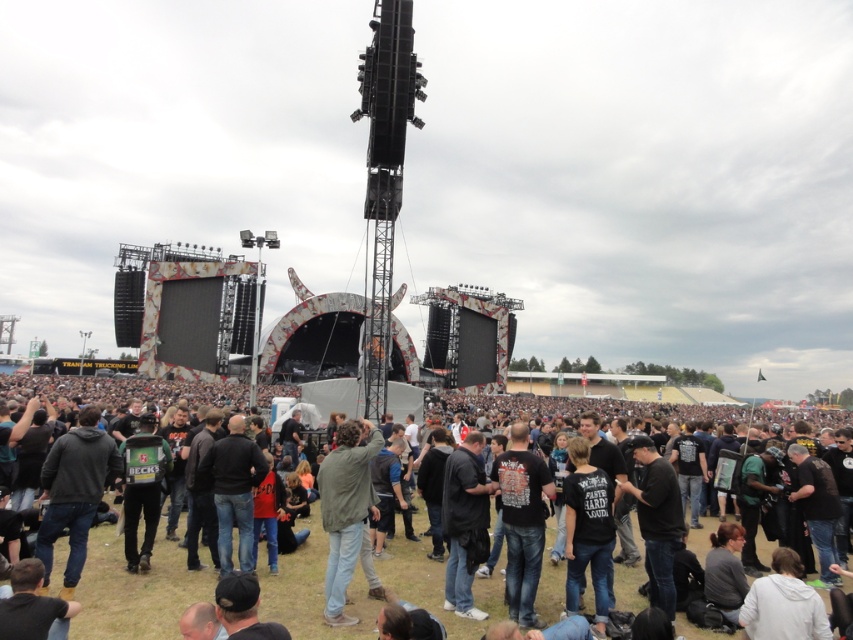
Question: Which of the following is the farthest from the observer?

Choices:
 (A) (512, 467)
 (B) (355, 500)
 (C) (160, 548)
 (D) (471, 445)

Answer: (D)

Question: From the image, what is the correct spatial relationship of dark gray clothing at center in relation to black matte jacket at center?

Choices:
 (A) above
 (B) below

Answer: (A)

Question: Which is farther from the black matte t-shirt at center?

Choices:
 (A) green matte jacket at center
 (B) dark gray clothing at center
 (C) black matte jacket at center

Answer: (A)

Question: Can you confirm if black matte t-shirt at center is bigger than black matte jacket at center?

Choices:
 (A) no
 (B) yes

Answer: (B)

Question: Is green matte jacket at center positioned before black matte jacket at center?

Choices:
 (A) yes
 (B) no

Answer: (A)

Question: Which point appears closest to the camera in this image?

Choices:
 (A) (537, 492)
 (B) (349, 566)
 (C) (132, 621)

Answer: (C)